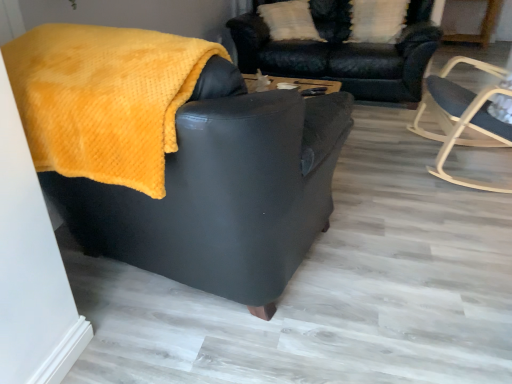
Question: Is white textured pillow at upper center to the left of matte black armchair at center, which is counted as the second chair, starting from the right, from the viewer's perspective?

Choices:
 (A) yes
 (B) no

Answer: (B)

Question: From a real-world perspective, is white textured pillow at upper center physically below matte black armchair at center, which is counted as the second chair, starting from the right?

Choices:
 (A) no
 (B) yes

Answer: (A)

Question: Is white textured pillow at upper center facing towards matte black armchair at center, which is counted as the second chair, starting from the right?

Choices:
 (A) no
 (B) yes

Answer: (B)

Question: Is the position of white textured pillow at upper center more distant than that of matte black armchair at center, which is counted as the second chair, starting from the right?

Choices:
 (A) yes
 (B) no

Answer: (A)

Question: Does white textured pillow at upper center have a larger size compared to matte black armchair at center, which is counted as the second chair, starting from the right?

Choices:
 (A) no
 (B) yes

Answer: (A)

Question: Looking at the image, does white textured pillow at upper center seem bigger or smaller compared to light wood rocking chair at right, acting as the 1th chair starting from the right?

Choices:
 (A) big
 (B) small

Answer: (B)

Question: From the image's perspective, relative to light wood rocking chair at right, placed as the 2th chair when sorted from left to right, is white textured pillow at upper center above or below?

Choices:
 (A) above
 (B) below

Answer: (A)

Question: Is white textured pillow at upper center to the left or to the right of light wood rocking chair at right, placed as the 2th chair when sorted from left to right, in the image?

Choices:
 (A) left
 (B) right

Answer: (A)

Question: Relative to light wood rocking chair at right, placed as the 2th chair when sorted from left to right, is white textured pillow at upper center in front or behind?

Choices:
 (A) behind
 (B) front

Answer: (A)

Question: Looking at their shapes, would you say velvet black couch at upper center is wider or thinner than white textured pillow at upper center?

Choices:
 (A) wide
 (B) thin

Answer: (A)

Question: In terms of size, does velvet black couch at upper center appear bigger or smaller than white textured pillow at upper center?

Choices:
 (A) small
 (B) big

Answer: (B)

Question: Is point (410, 29) positioned closer to the camera than point (379, 39)?

Choices:
 (A) closer
 (B) farther

Answer: (A)

Question: From the image's perspective, is velvet black couch at upper center above or below white textured pillow at upper center?

Choices:
 (A) below
 (B) above

Answer: (A)

Question: Would you say matte black armchair at center, which is counted as the second chair, starting from the right, is inside or outside white textured pillow at upper center?

Choices:
 (A) outside
 (B) inside

Answer: (A)

Question: From a real-world perspective, relative to white textured pillow at upper center, is matte black armchair at center, the 1th chair viewed from the left, vertically above or below?

Choices:
 (A) below
 (B) above

Answer: (A)